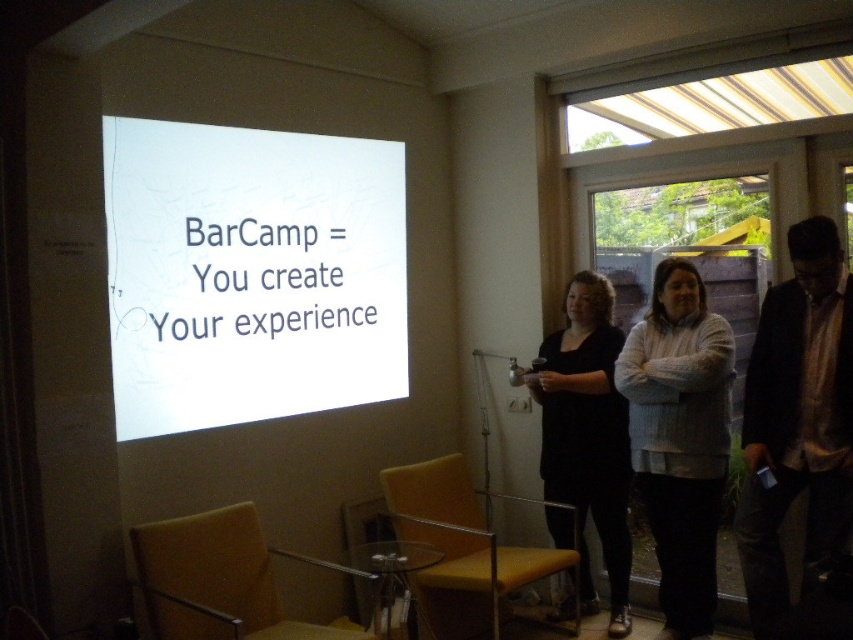
You are attending a presentation and want to take a photo of the white knitted sweater at center. If your camera has a maximum focus range of 10 feet, will you be able to capture it clearly?

The white knitted sweater at center is 9.86 feet away from the viewer, which is within the camera maximum focus range of 10 feet. Therefore, you can capture it clearly.

What are the coordinates of the white paper at upper center?

The white paper at upper center is located at point (250, 273).

You are an attendee at the event and want to see the presentation clearly. Which object is closer to you between the white paper at upper center and the matte black dress at center?

The white paper at upper center is closer to you because it is in front of the matte black dress at center.